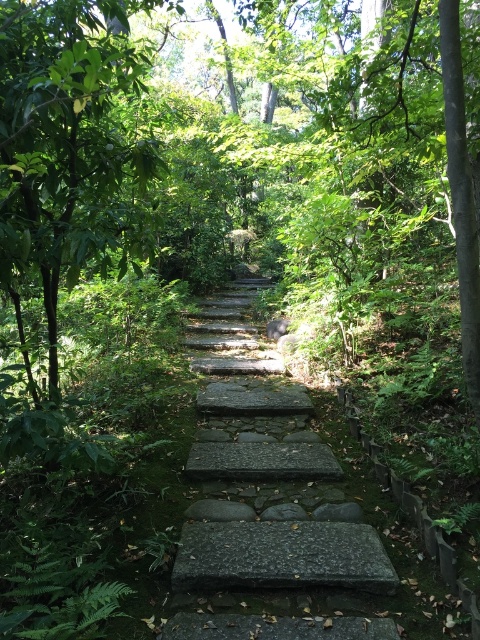
Is green leafy tree at center further to camera compared to gray stone stairs at center?

That is False.

Describe the element at coordinates (67, 144) in the screenshot. I see `green leafy tree at center` at that location.

Where is `green leafy tree at center`? The image size is (480, 640). green leafy tree at center is located at coordinates (67, 144).

You are a GUI agent. You are given a task and a screenshot of the screen. Output one action in this format:
    pyautogui.click(x=<x>, y=<y>)
    Task: Click on the green leafy tree at center
    Image resolution: width=480 pixels, height=640 pixels.
    Given the screenshot: What is the action you would take?
    pyautogui.click(x=67, y=144)

Does green leafy tree at center have a larger size compared to granite stone at center?

Correct, green leafy tree at center is larger in size than granite stone at center.

Who is higher up, green leafy tree at center or granite stone at center?

Positioned higher is green leafy tree at center.

Does point (55, 195) come in front of point (271, 532)?

Yes, it is.

Where is `green leafy tree at center`? This screenshot has width=480, height=640. green leafy tree at center is located at coordinates (67, 144).

Does gray stone stairs at center have a smaller size compared to granite stone at center?

No, gray stone stairs at center is not smaller than granite stone at center.

Does gray stone stairs at center appear on the left side of granite stone at center?

Correct, you'll find gray stone stairs at center to the left of granite stone at center.

Is point (252, 508) in front of point (202, 589)?

That is False.

Locate an element on the screen. gray stone stairs at center is located at coordinates [x=276, y=552].